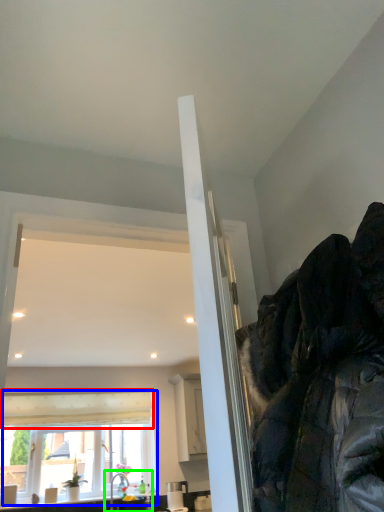
Question: Which object is positioned closest to curtain (highlighted by a red box)? Select from window (highlighted by a blue box) and sink (highlighted by a green box).

Choices:
 (A) window
 (B) sink

Answer: (A)